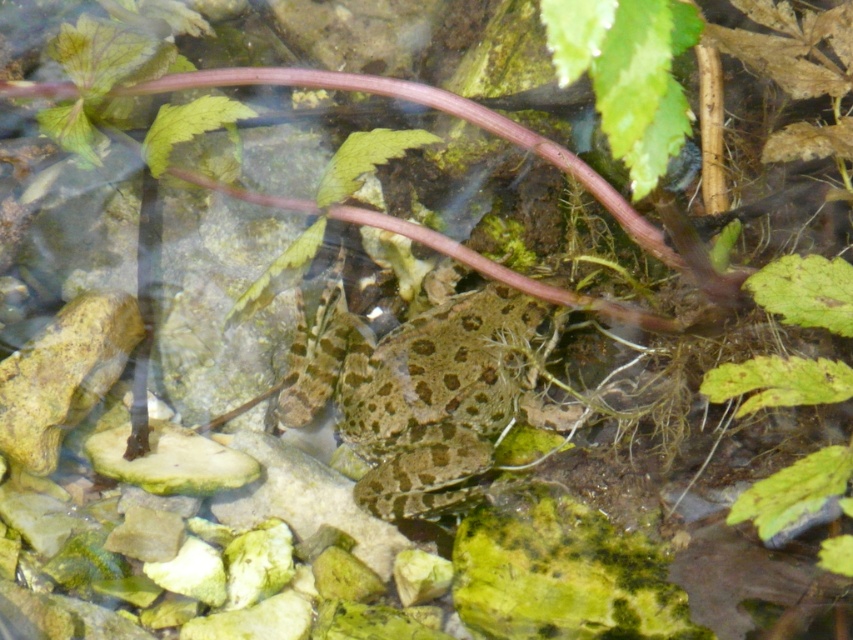
Who is positioned more to the left, speckled skin frog at center or green leafy plant at lower right?

Positioned to the left is speckled skin frog at center.

Between speckled skin frog at center and green leafy plant at lower right, which one appears on the right side from the viewer's perspective?

green leafy plant at lower right

Where is `speckled skin frog at center`? This screenshot has height=640, width=853. speckled skin frog at center is located at coordinates (413, 394).